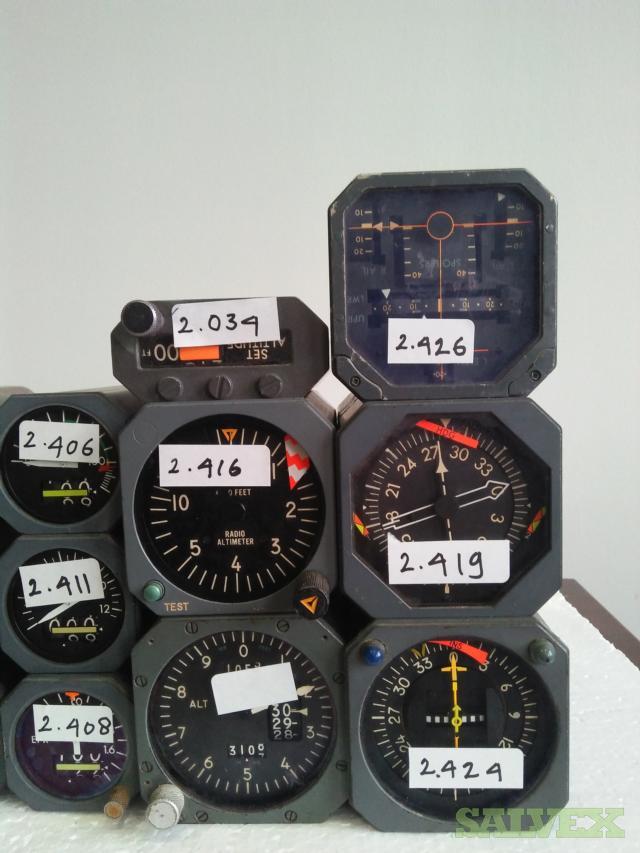
You are a GUI agent. You are given a task and a screenshot of the screen. Output one action in this format:
    pyautogui.click(x=<x>, y=<y>)
    Task: Click on the white wall
    Image resolution: width=640 pixels, height=853 pixels.
    Given the screenshot: What is the action you would take?
    pyautogui.click(x=555, y=114)